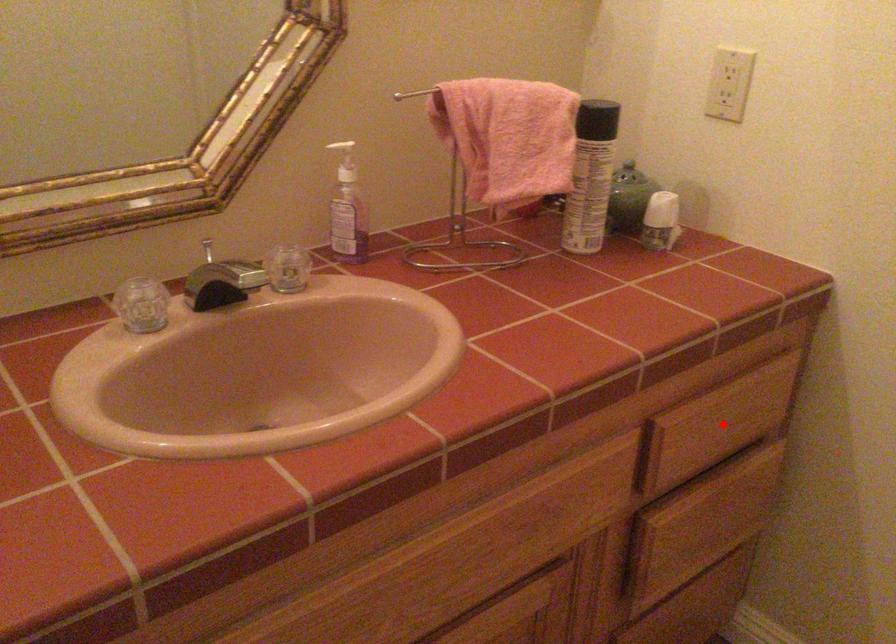
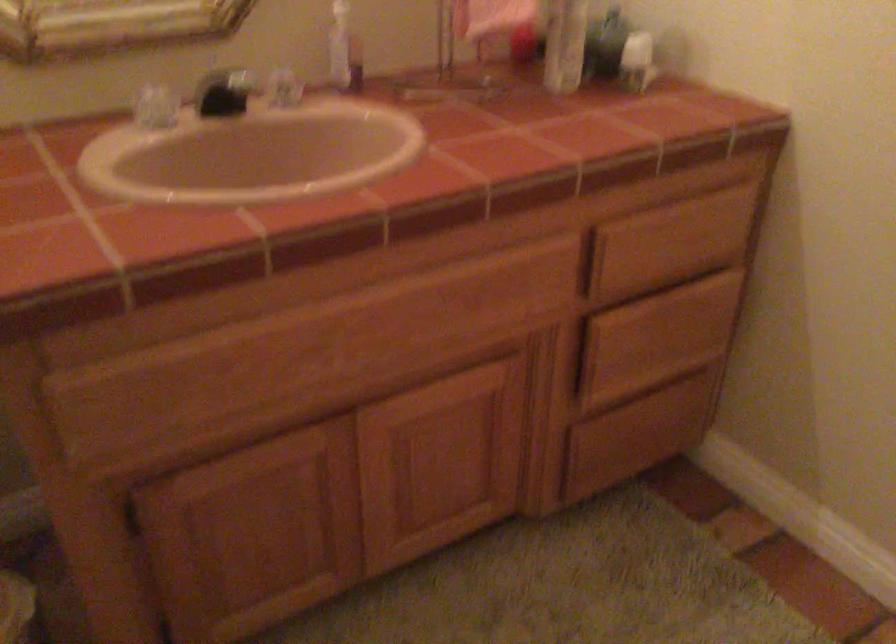
Find the pixel in the second image that matches the highlighted location in the first image.

(668, 243)